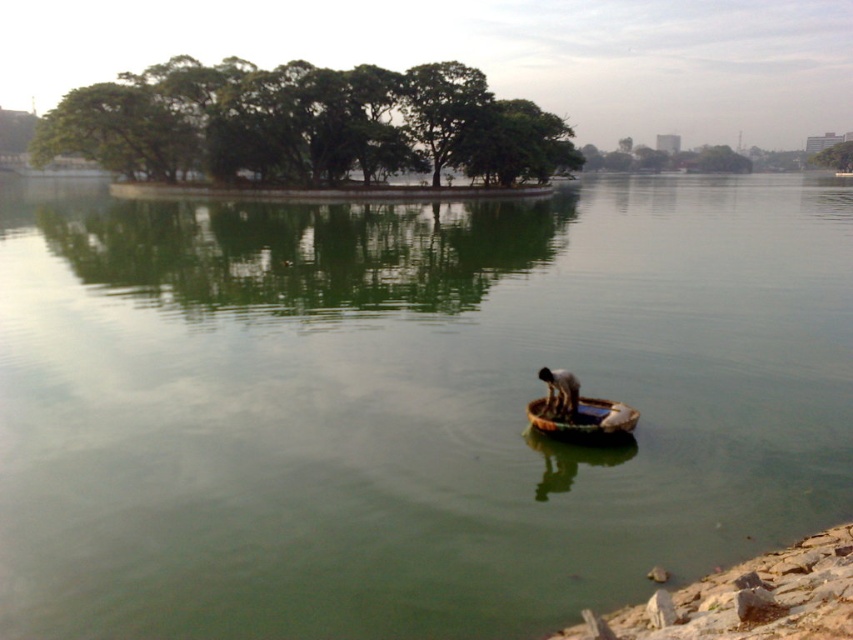
You are standing at the lakeside and want to reach both point [711,225] and point [589,397]. Which point is closer to you?

Point [711,225] is closer to you because it is further to the viewer than point [589,397].

You are standing on the lakeside dock and want to reach the brown woven basket at center. Which direction should you move to avoid stepping into the green smooth water at center?

The green smooth water at center is in front of the brown woven basket at center, so you should move sideways or behind the basket to avoid stepping into the water.